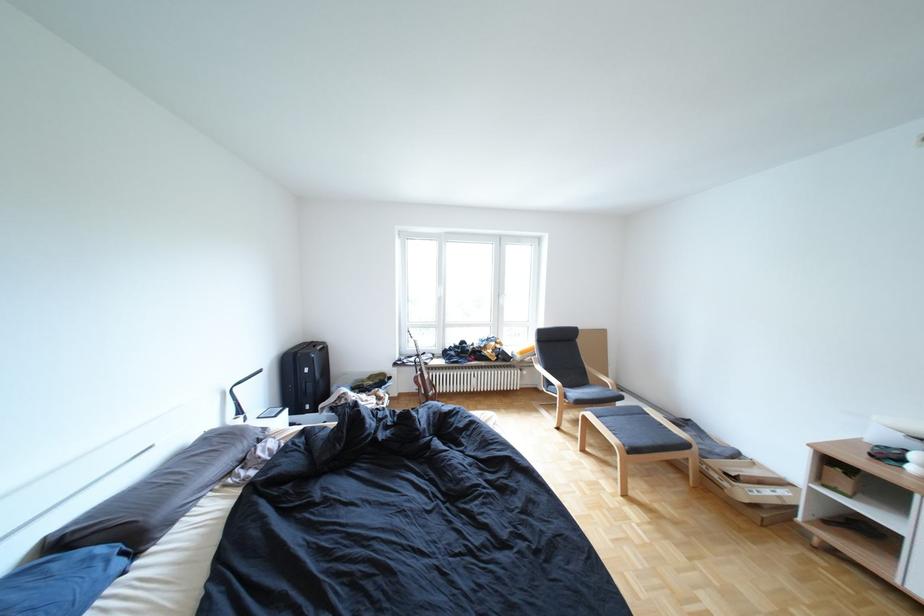
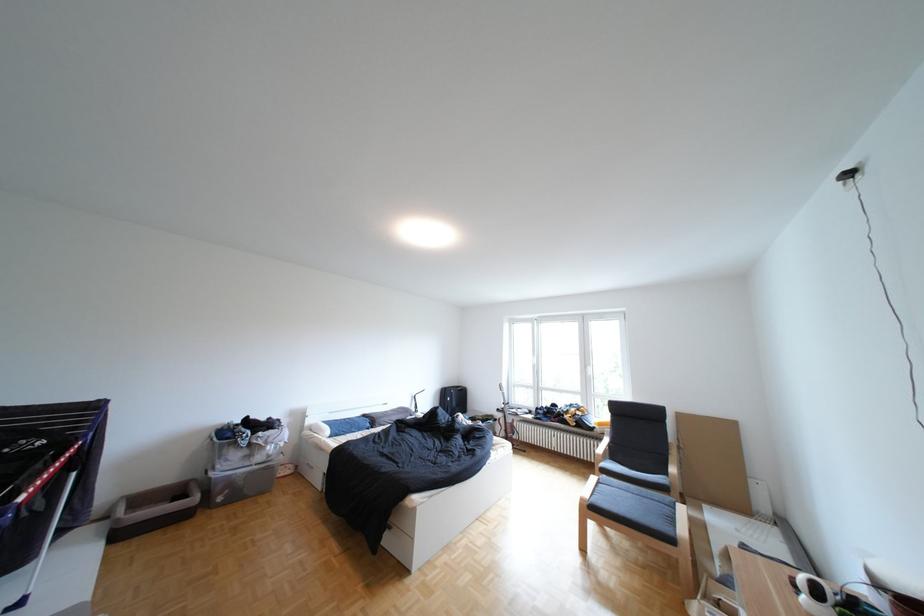
The point at (517, 411) is marked in the first image. Where is the corresponding point in the second image?

(584, 474)